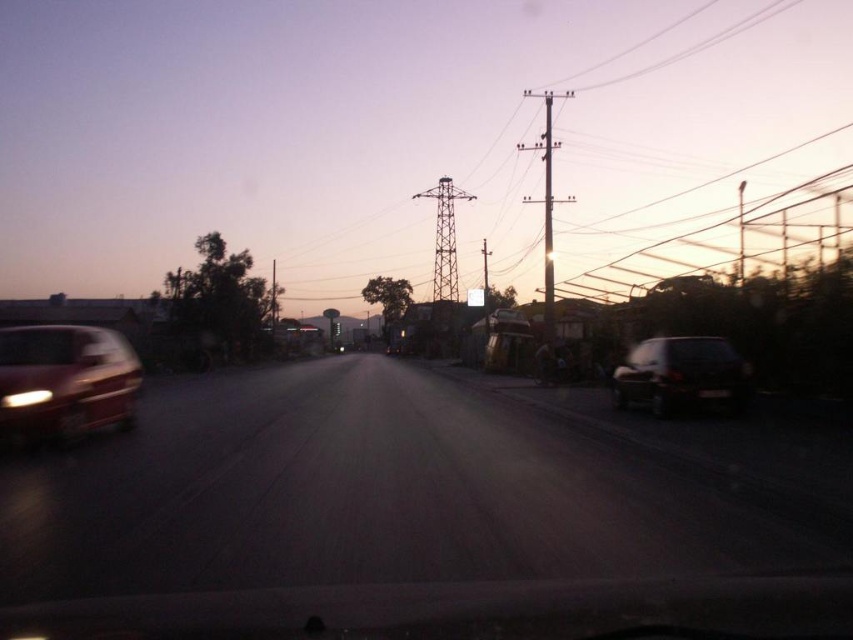
Between shiny red car at left and dark gray metallic car at right, which one is positioned lower?

dark gray metallic car at right

Is point (57, 348) less distant than point (718, 356)?

Yes.

Who is more forward, (102, 337) or (618, 397)?

Point (102, 337) is in front.

Find the location of a particular element. shiny red car at left is located at coordinates (64, 381).